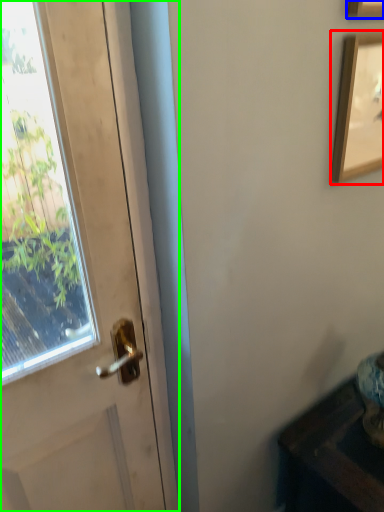
Question: Based on their relative distances, which object is nearer to picture frame (highlighted by a red box)? Choose from picture frame (highlighted by a blue box) and door (highlighted by a green box).

Choices:
 (A) picture frame
 (B) door

Answer: (A)